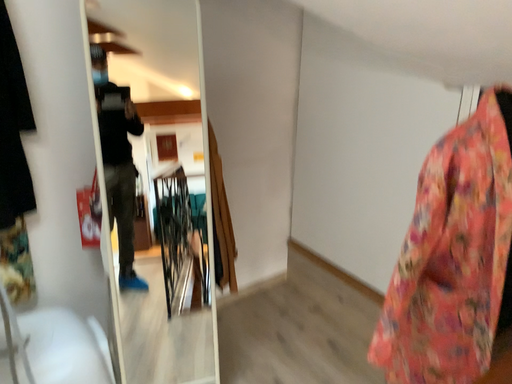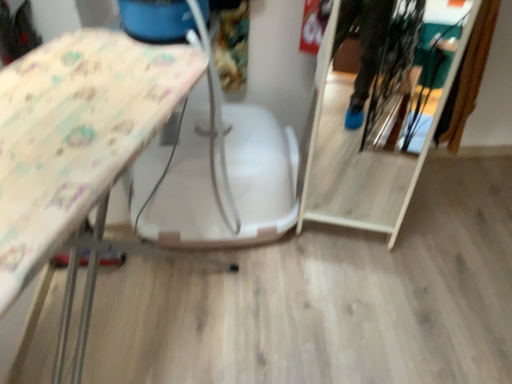
Question: How did the camera likely rotate when shooting the video?

Choices:
 (A) rotated left
 (B) rotated right

Answer: (A)